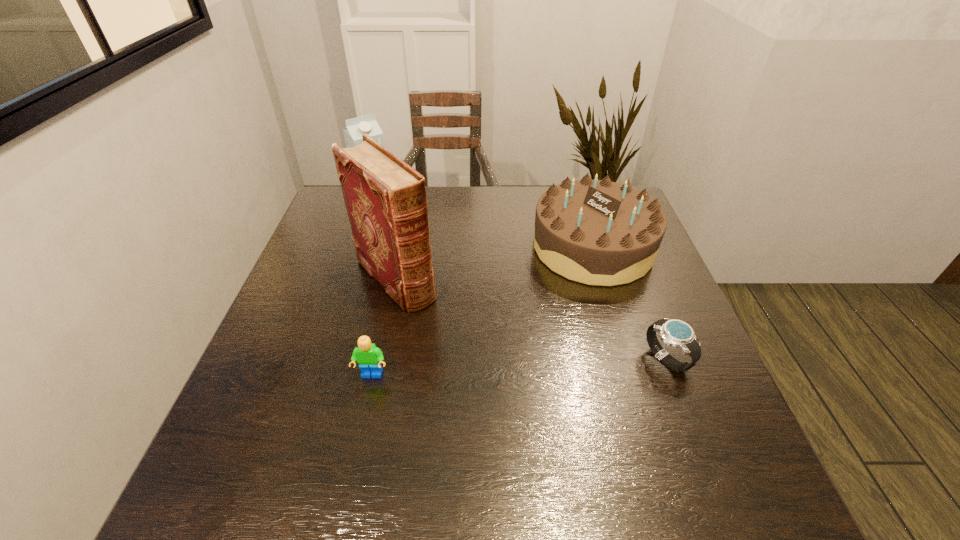
Locate an element on the screen. Image resolution: width=960 pixels, height=540 pixels. free space that is in between the second shortest object and the shortest object is located at coordinates (519, 367).

Find the location of a particular element. The image size is (960, 540). unoccupied position between the watch and the fourth tallest object is located at coordinates (519, 367).

Identify the location of vacant area that lies between the fourth shortest object and the fourth tallest object. (373, 289).

Where is `unoccupied position between the Lego and the watch`? unoccupied position between the Lego and the watch is located at coordinates (519, 367).

You are a GUI agent. You are given a task and a screenshot of the screen. Output one action in this format:
    pyautogui.click(x=<x>, y=<y>)
    Task: Click on the empty location between the Lego and the tallest object
    This screenshot has width=960, height=540.
    Given the screenshot: What is the action you would take?
    pos(384,327)

Where is `free spot between the third tallest object and the tallest object`? free spot between the third tallest object and the tallest object is located at coordinates (494, 263).

I want to click on free space between the fourth tallest object and the second tallest object, so click(373, 289).

Find the location of `unoccupied position between the shortest object and the third shortest object`. unoccupied position between the shortest object and the third shortest object is located at coordinates (630, 303).

I want to click on the second closest object to the birthday cake, so click(x=385, y=198).

In order to click on object that is the third closest one to the shortest object in this screenshot , I will do `click(369, 357)`.